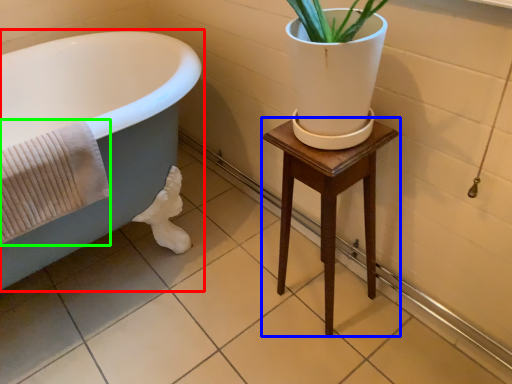
Question: Which object is the farthest from bathtub (highlighted by a red box)? Choose among these: furniture (highlighted by a blue box) or bath towel (highlighted by a green box).

Choices:
 (A) furniture
 (B) bath towel

Answer: (A)